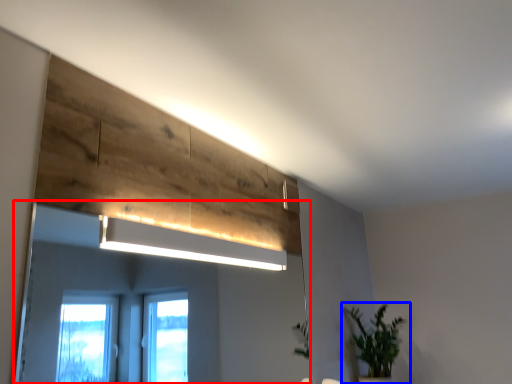
Question: Which object appears farthest to the camera in this image, mirror (highlighted by a red box) or houseplant (highlighted by a blue box)?

Choices:
 (A) mirror
 (B) houseplant

Answer: (B)